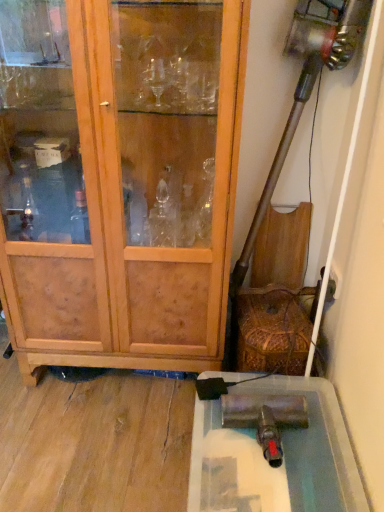
This screenshot has width=384, height=512. Describe the element at coordinates (119, 179) in the screenshot. I see `wooden cabinet at left` at that location.

The width and height of the screenshot is (384, 512). I want to click on wooden cabinet at left, so click(119, 179).

Image resolution: width=384 pixels, height=512 pixels. What are the coordinates of `metallic silver cabinet at lower right` in the screenshot? It's located at (283, 458).

What do you see at coordinates (283, 458) in the screenshot?
I see `metallic silver cabinet at lower right` at bounding box center [283, 458].

Find the location of a particular element. wooden cabinet at left is located at coordinates (119, 179).

Which object is positioned more to the left, wooden cabinet at left or metallic silver cabinet at lower right?

wooden cabinet at left.

Considering their positions, is wooden cabinet at left located in front of or behind metallic silver cabinet at lower right?

wooden cabinet at left is in front of metallic silver cabinet at lower right.

Which point is more forward, (73, 3) or (287, 442)?

Positioned in front is point (73, 3).

From the image's perspective, who appears lower, wooden cabinet at left or metallic silver cabinet at lower right?

metallic silver cabinet at lower right appears lower in the image.

From a real-world perspective, between wooden cabinet at left and metallic silver cabinet at lower right, who is vertically higher?

wooden cabinet at left, from a real-world perspective.

Between wooden cabinet at left and metallic silver cabinet at lower right, which one has smaller width?

With smaller width is wooden cabinet at left.

Can you confirm if wooden cabinet at left is shorter than metallic silver cabinet at lower right?

In fact, wooden cabinet at left may be taller than metallic silver cabinet at lower right.

Which of these two, wooden cabinet at left or metallic silver cabinet at lower right, is bigger?

With larger size is wooden cabinet at left.

Is wooden cabinet at left situated inside metallic silver cabinet at lower right or outside?

wooden cabinet at left exists outside the volume of metallic silver cabinet at lower right.

Is wooden cabinet at left far from metallic silver cabinet at lower right?

wooden cabinet at left is actually quite close to metallic silver cabinet at lower right.

Could you tell me if wooden cabinet at left is facing metallic silver cabinet at lower right?

No, wooden cabinet at left does not turn towards metallic silver cabinet at lower right.

How much distance is there between wooden cabinet at left and metallic silver cabinet at lower right?

wooden cabinet at left and metallic silver cabinet at lower right are 23.75 inches apart.

You are a GUI agent. You are given a task and a screenshot of the screen. Output one action in this format:
    pyautogui.click(x=<x>, y=<y>)
    Task: Click on the cupboard that appears above the metallic silver cabinet at lower right (from the image's perspective)
    Image resolution: width=384 pixels, height=512 pixels.
    Given the screenshot: What is the action you would take?
    pyautogui.click(x=119, y=179)

Between metallic silver cabinet at lower right and wooden cabinet at left, which one appears on the right side from the viewer's perspective?

Result: metallic silver cabinet at lower right is more to the right.

Which is behind, metallic silver cabinet at lower right or wooden cabinet at left?

metallic silver cabinet at lower right.

Is point (199, 400) positioned behind point (67, 344)?

That is False.

From the image's perspective, is metallic silver cabinet at lower right beneath wooden cabinet at left?

Yes.

Consider the image. From a real-world perspective, is metallic silver cabinet at lower right positioned under wooden cabinet at left based on gravity?

Yes, from a real-world perspective, metallic silver cabinet at lower right is under wooden cabinet at left.

Is metallic silver cabinet at lower right thinner than wooden cabinet at left?

No, metallic silver cabinet at lower right is not thinner than wooden cabinet at left.

Does metallic silver cabinet at lower right have a lesser height compared to wooden cabinet at left?

Yes.

Is metallic silver cabinet at lower right bigger than wooden cabinet at left?

No, metallic silver cabinet at lower right is not bigger than wooden cabinet at left.

Is metallic silver cabinet at lower right completely or partially outside of wooden cabinet at left?

That's correct, metallic silver cabinet at lower right is outside of wooden cabinet at left.

Is there a large distance between metallic silver cabinet at lower right and wooden cabinet at left?

metallic silver cabinet at lower right is actually quite close to wooden cabinet at left.

Is metallic silver cabinet at lower right oriented towards wooden cabinet at left?

No, metallic silver cabinet at lower right does not turn towards wooden cabinet at left.

The height and width of the screenshot is (512, 384). Find the location of `cabinetry that appears below the wooden cabinet at left (from a real-world perspective)`. cabinetry that appears below the wooden cabinet at left (from a real-world perspective) is located at coordinates (283, 458).

You are a GUI agent. You are given a task and a screenshot of the screen. Output one action in this format:
    pyautogui.click(x=<x>, y=<y>)
    Task: Click on the cupboard above the metallic silver cabinet at lower right (from the image's perspective)
    This screenshot has height=512, width=384.
    Given the screenshot: What is the action you would take?
    pyautogui.click(x=119, y=179)

Find the location of a particular element. This screenshot has height=512, width=384. cabinetry behind the wooden cabinet at left is located at coordinates (283, 458).